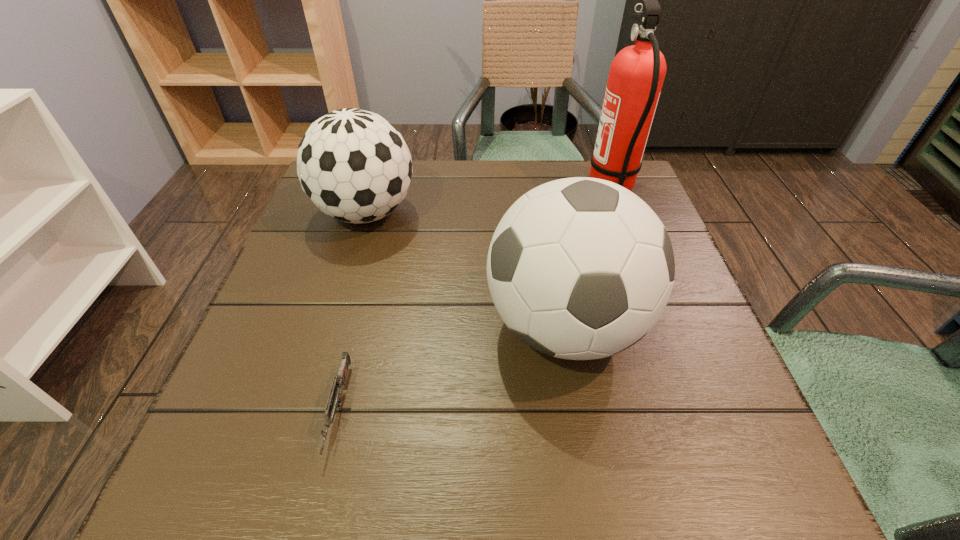
Identify the location of free spot between the taller soccer ball and the shortest object. The height and width of the screenshot is (540, 960). (452, 368).

Where is `vacant space in between the nearer soccer ball and the shortest object`? The image size is (960, 540). vacant space in between the nearer soccer ball and the shortest object is located at coordinates (452, 368).

Locate an element on the screen. vacant point located between the third tallest object and the fire extinguisher is located at coordinates (489, 201).

Select which object is the second closest to the farther soccer ball. Please provide its 2D coordinates. Your answer should be formatted as a tuple, i.e. [(x, y)], where the tuple contains the x and y coordinates of a point satisfying the conditions above.

[(335, 397)]

Select which object is the third closest to the shorter soccer ball. Please provide its 2D coordinates. Your answer should be formatted as a tuple, i.e. [(x, y)], where the tuple contains the x and y coordinates of a point satisfying the conditions above.

[(636, 76)]

Identify the location of vacant space that satisfies the following two spatial constraints: 1. on the handle side of the fire extinguisher; 2. aimed along the barrel of the gun. (694, 409).

Image resolution: width=960 pixels, height=540 pixels. In order to click on free point that satisfies the following two spatial constraints: 1. on the handle side of the fire extinguisher; 2. on the front side of the shorter soccer ball in this screenshot , I will do `click(620, 213)`.

Identify the location of free space that satisfies the following two spatial constraints: 1. on the handle side of the fire extinguisher; 2. aimed along the barrel of the gun. This screenshot has height=540, width=960. (694, 409).